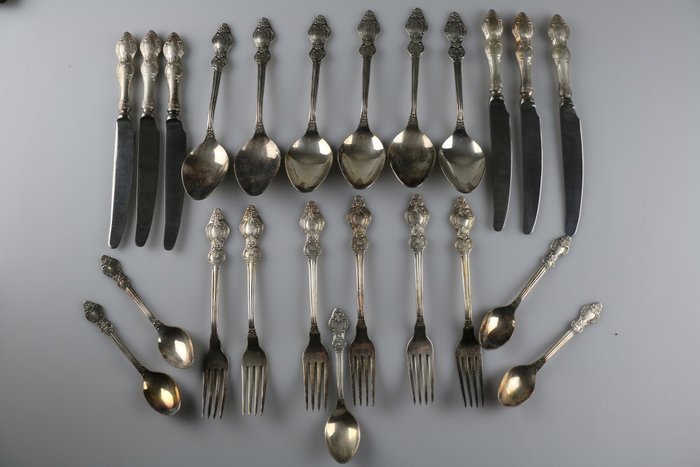
I want to click on small spoons, so click(155, 391), click(173, 357), click(339, 419), click(517, 389), click(494, 329).